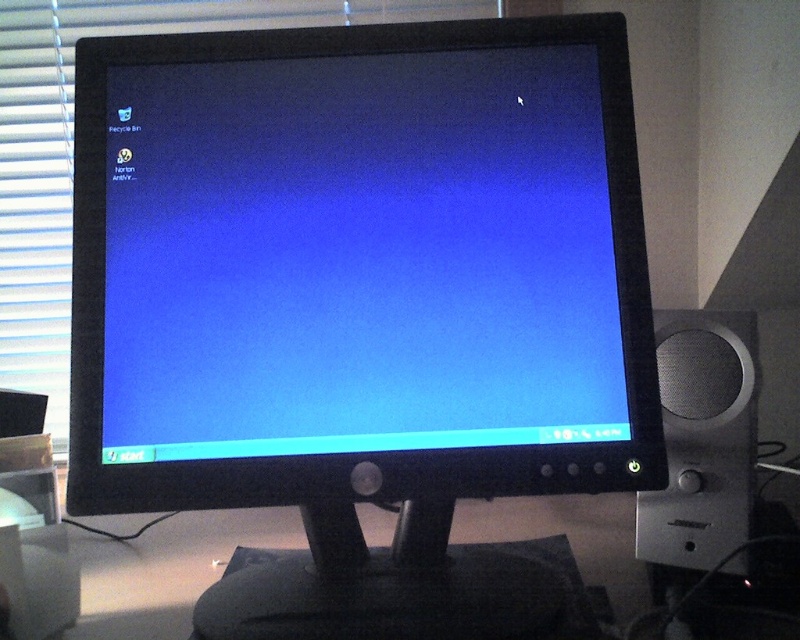
Consider the image. You are setting up a new monitor and need to ensure the silver metallic speaker at right is visible. Is the white matte blind at upper left blocking it?

The white matte blind at upper left is positioned over the silver metallic speaker at right, so it is blocking the speaker.

You are looking at the computer monitor and notice a point on the screen. What object is located at the point with coordinates (72, 148)?

The point at coordinates (72, 148) corresponds to the white matte blind at upper left.

You are setting up a new monitor and need to know if the black glossy monitor at center will fit in the space currently occupied by the white matte blind at upper left. Based on their dimensions, will it fit?

The black glossy monitor at center is thinner than the white matte blind at upper left, so it should fit in the space.